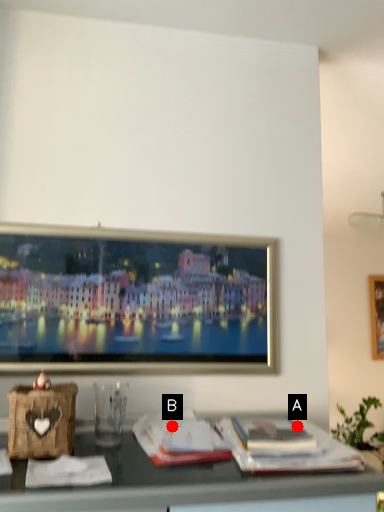
Question: Two points are circled on the image, labeled by A and B beside each circle. Which point appears farthest from the camera in this image?

Choices:
 (A) A is further
 (B) B is further

Answer: (B)